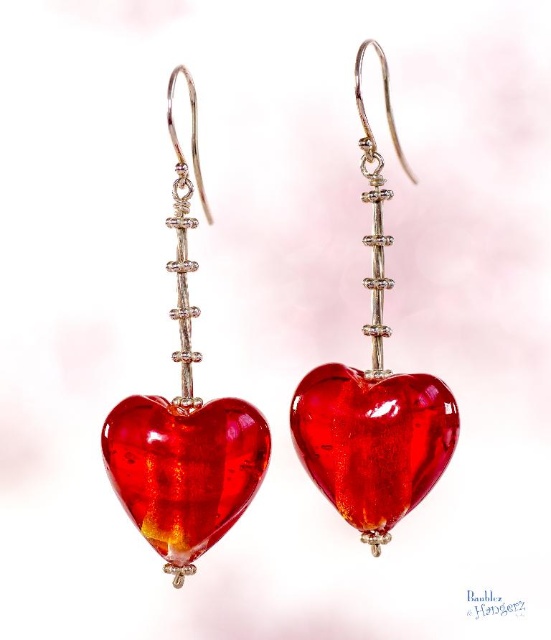
You are a photographer trying to capture a closeup of the shiny glass heart at center. If your camera lens has a minimum focusing distance of 3 feet, will you be able to take the photo without any additional equipment?

The shiny glass heart at center is 3.50 feet away from the camera. Since the minimum focusing distance is 3 feet, the photographer can take the closeup without needing additional equipment because the current distance is within the lens capability.